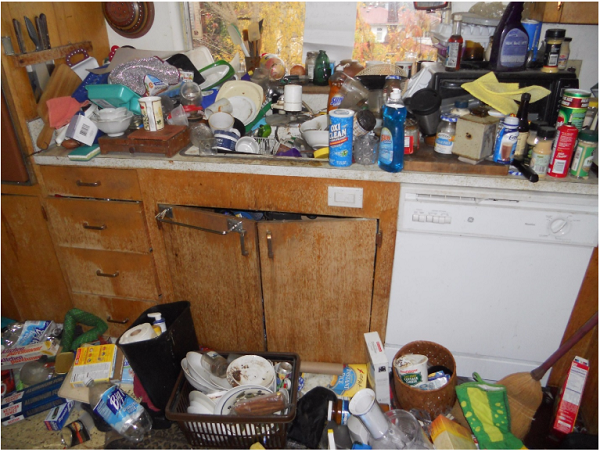
Find the location of a particular element. The width and height of the screenshot is (600, 452). wooden drawer is located at coordinates (121, 229), (121, 196), (121, 277), (122, 310).